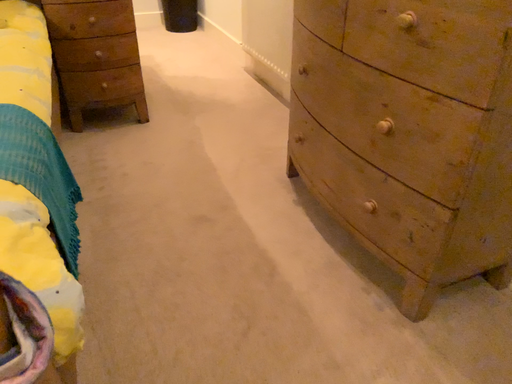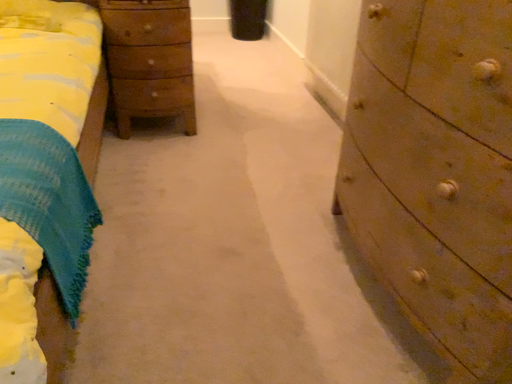
Question: Which way did the camera rotate in the video?

Choices:
 (A) rotated left
 (B) rotated right

Answer: (A)